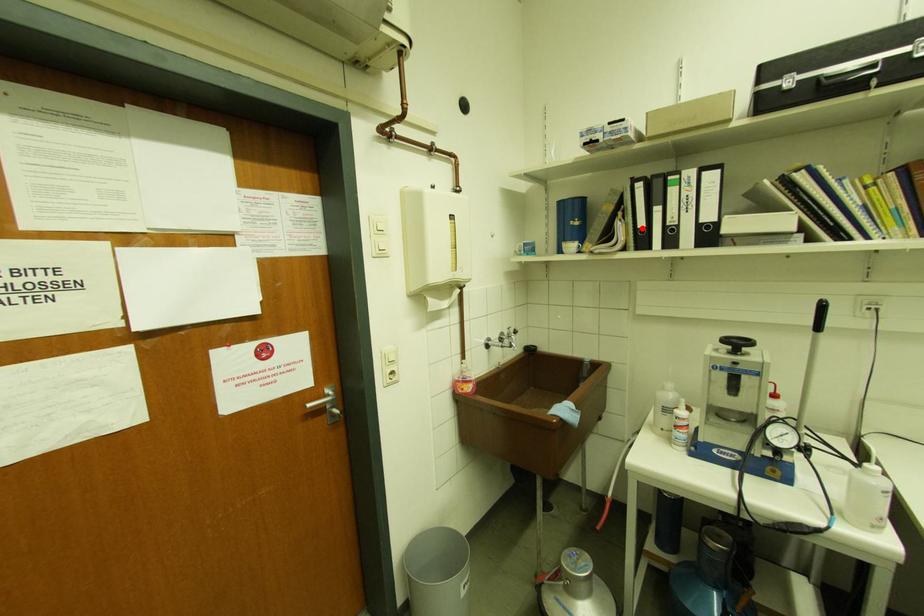
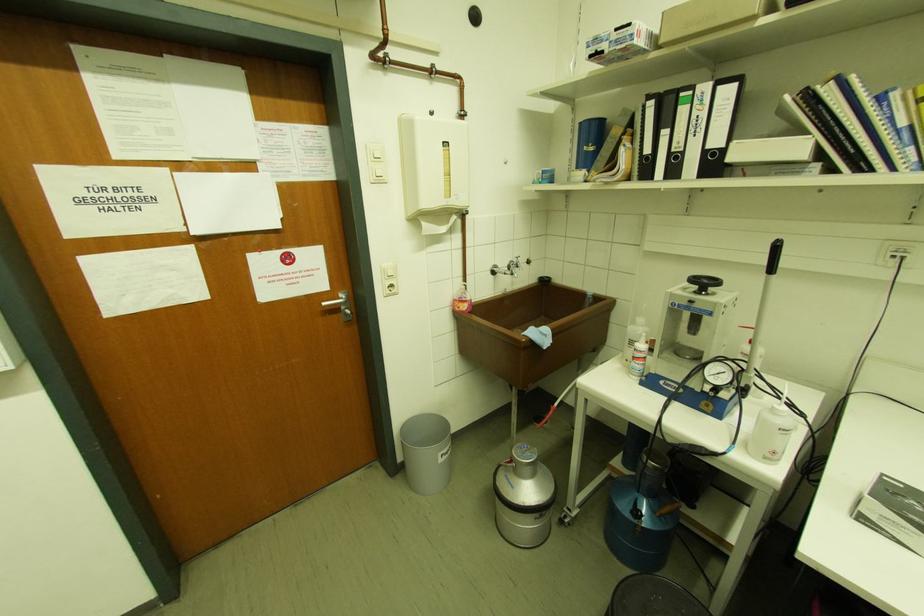
In the second image, find the point that corresponds to the highlighted location in the first image.

(648, 155)